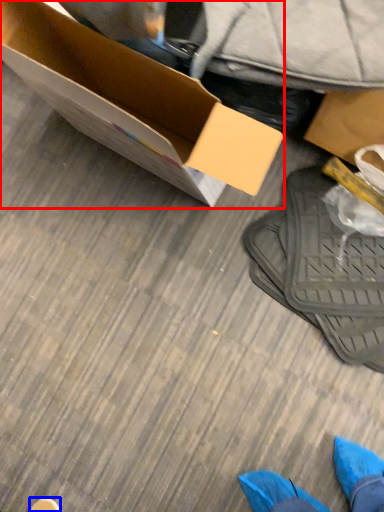
Question: Which object appears closest to the camera in this image, box (highlighted by a red box) or shoe (highlighted by a blue box)?

Choices:
 (A) box
 (B) shoe

Answer: (A)